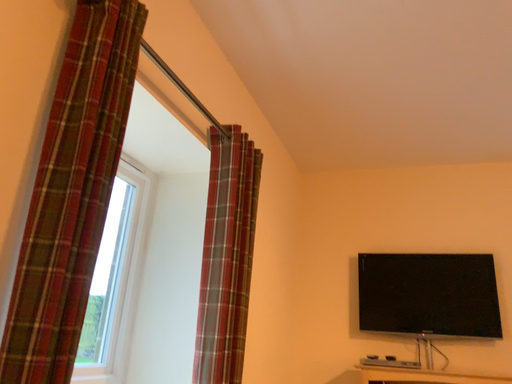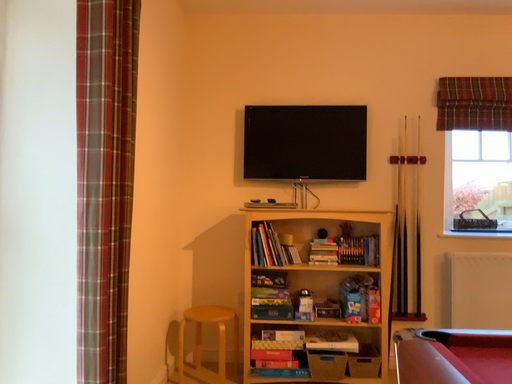
Question: How did the camera likely rotate when shooting the video?

Choices:
 (A) rotated right
 (B) rotated left

Answer: (A)